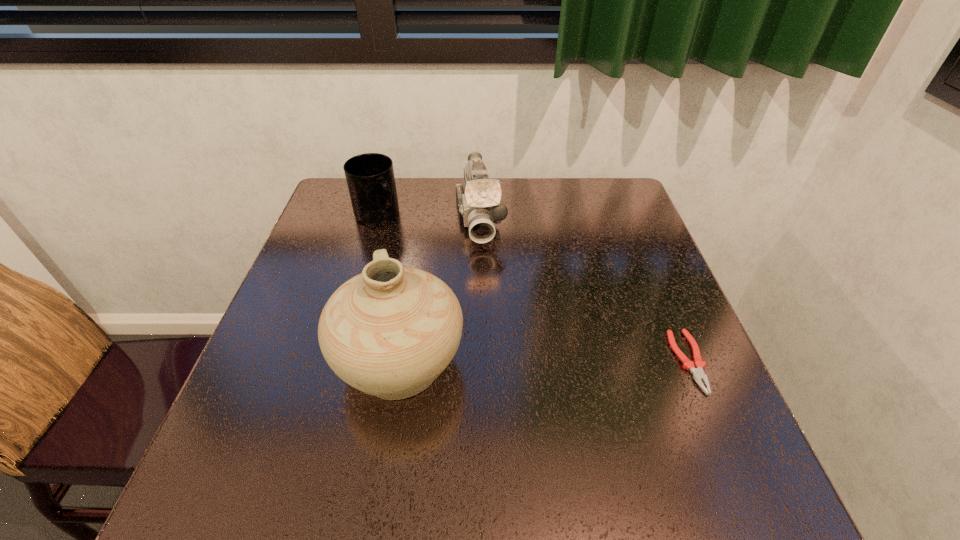
In order to click on free space on the desktop that is between the tallest object and the pliers and is positioned on the front-facing side of the camcorder in this screenshot , I will do `click(501, 362)`.

You are a GUI agent. You are given a task and a screenshot of the screen. Output one action in this format:
    pyautogui.click(x=<x>, y=<y>)
    Task: Click on the free spot on the desktop that is between the tallest object and the shortest object and is positioned on the side of the mug with the handle
    Image resolution: width=960 pixels, height=540 pixels.
    Given the screenshot: What is the action you would take?
    pyautogui.click(x=519, y=362)